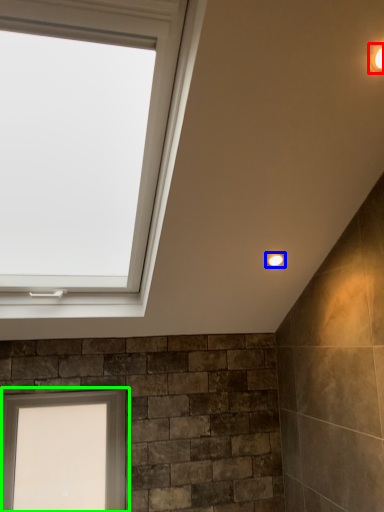
Question: Considering the real-world distances, which object is farthest from light fixture (highlighted by a red box)? light fixture (highlighted by a blue box) or window (highlighted by a green box)?

Choices:
 (A) light fixture
 (B) window

Answer: (B)